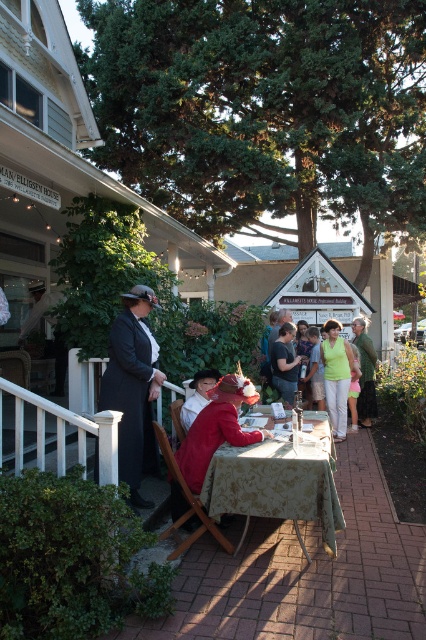
Consider the image. Between light green fabric at center and green fabric dress at center, which one has less height?

green fabric dress at center

Does point (339, 394) come in front of point (310, 372)?

That is True.

Between point (327, 385) and point (319, 355), which one is positioned behind?

The point (319, 355) is more distant.

Where is `light green fabric at center`? Image resolution: width=426 pixels, height=640 pixels. light green fabric at center is located at coordinates (336, 376).

Who is taller, dark gray cotton shirt at center or green fabric dress at center?

green fabric dress at center is taller.

Does dark gray cotton shirt at center have a larger size compared to green fabric dress at center?

No.

The width and height of the screenshot is (426, 640). Find the location of `dark gray cotton shirt at center`. dark gray cotton shirt at center is located at coordinates 284,364.

Find the location of a particular element. dark gray cotton shirt at center is located at coordinates (284, 364).

Who is lower down, green floral tablecloth at center or matte black dress at left?

green floral tablecloth at center is lower down.

Is green floral tablecloth at center taller than matte black dress at left?

Incorrect, green floral tablecloth at center's height is not larger of matte black dress at left's.

Image resolution: width=426 pixels, height=640 pixels. What do you see at coordinates (275, 484) in the screenshot? I see `green floral tablecloth at center` at bounding box center [275, 484].

You are a GUI agent. You are given a task and a screenshot of the screen. Output one action in this format:
    pyautogui.click(x=<x>, y=<y>)
    Task: Click on the green floral tablecloth at center
    The width and height of the screenshot is (426, 640).
    Given the screenshot: What is the action you would take?
    pyautogui.click(x=275, y=484)